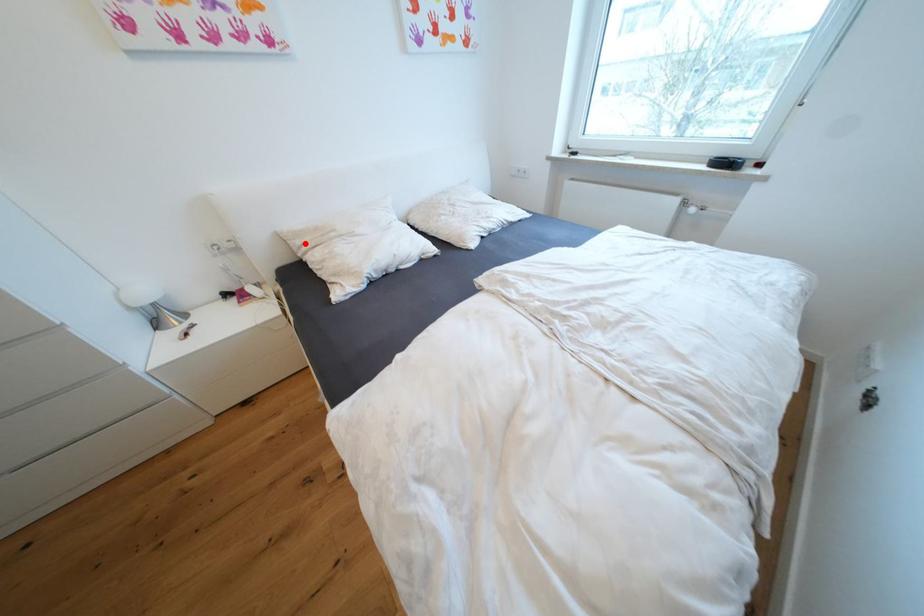
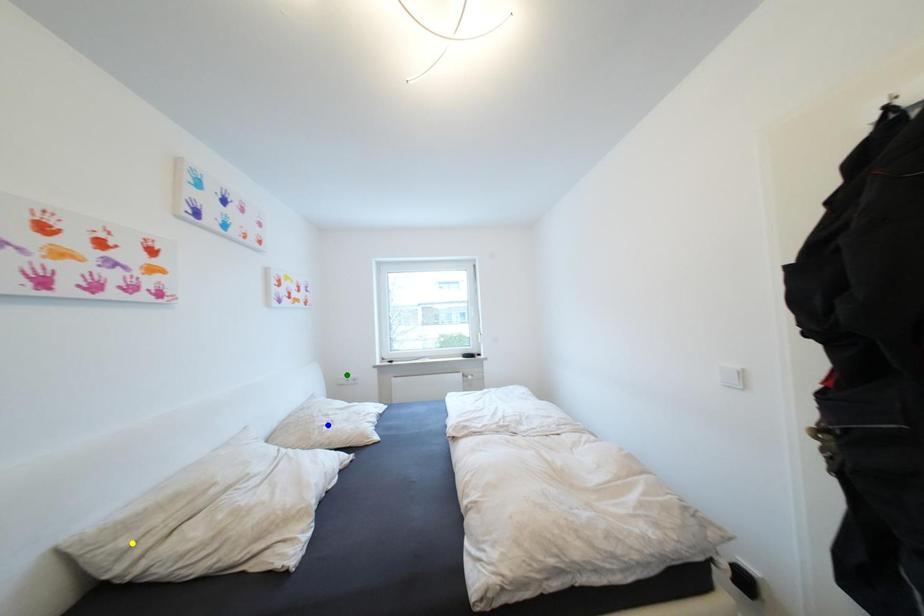
Question: I am providing you with two images of the same scene from different viewpoints. A red point is marked on the first image. You are given multiple points on the second image. Which point in image 2 is actually the same real-world point as the red point in image 1?

Choices:
 (A) yellow point
 (B) green point
 (C) blue point

Answer: (A)